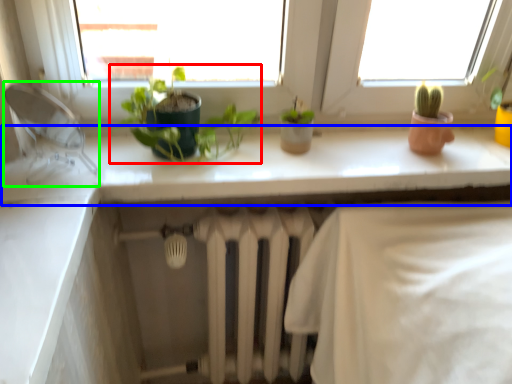
Question: Estimate the real-world distances between objects in this image. Which object is farther from houseplant (highlighted by a red box), counter top (highlighted by a blue box) or faucet (highlighted by a green box)?

Choices:
 (A) counter top
 (B) faucet

Answer: (B)